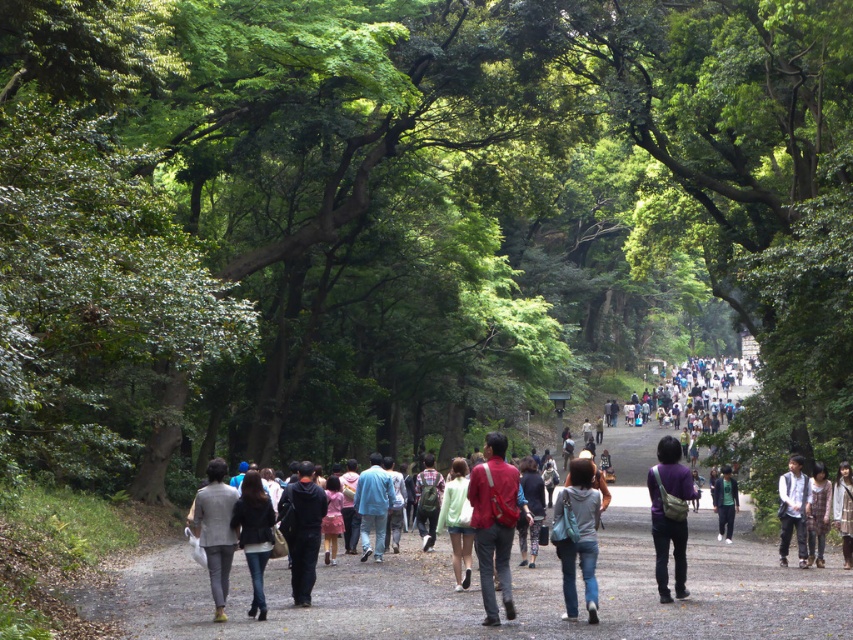
Question: Which point appears closest to the camera in this image?

Choices:
 (A) (849, 506)
 (B) (265, 604)

Answer: (B)

Question: Which is nearer to the light gray fabric jacket at lower right?

Choices:
 (A) light blue denim jacket at center
 (B) denim jeans at center

Answer: (A)

Question: Observing the image, what is the correct spatial positioning of matte red backpack at center in reference to green cotton shirt at center?

Choices:
 (A) left
 (B) right

Answer: (A)

Question: Can you confirm if light blue denim jacket at center is positioned to the right of light brown fabric jacket at lower right?

Choices:
 (A) no
 (B) yes

Answer: (A)

Question: Considering the real-world distances, which object is farthest from the matte red backpack at center?

Choices:
 (A) dark blue hoodie at center
 (B) green knapsack at center
 (C) light blue denim jacket at center

Answer: (C)

Question: Is matte red backpack at center to the right of light brown fabric jacket at lower right from the viewer's perspective?

Choices:
 (A) no
 (B) yes

Answer: (A)